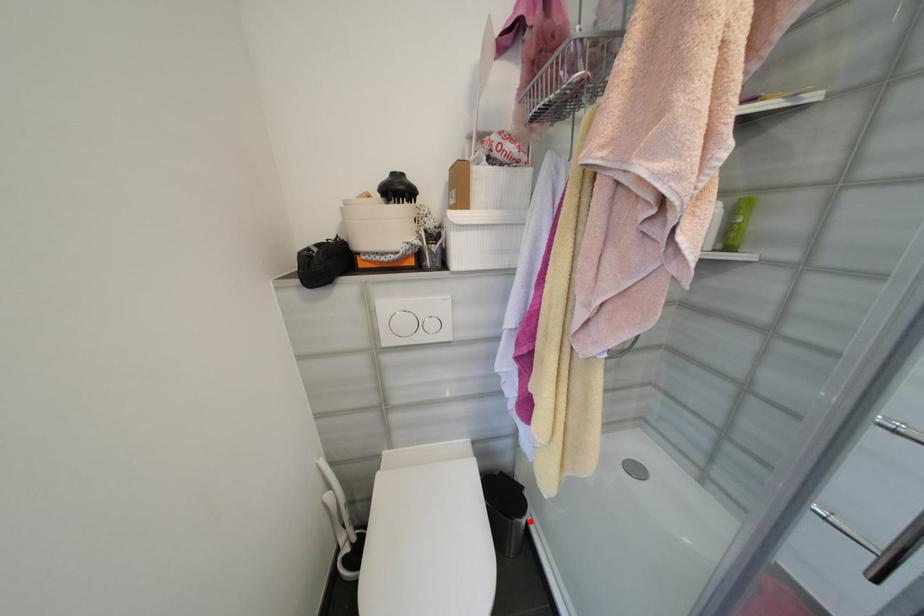
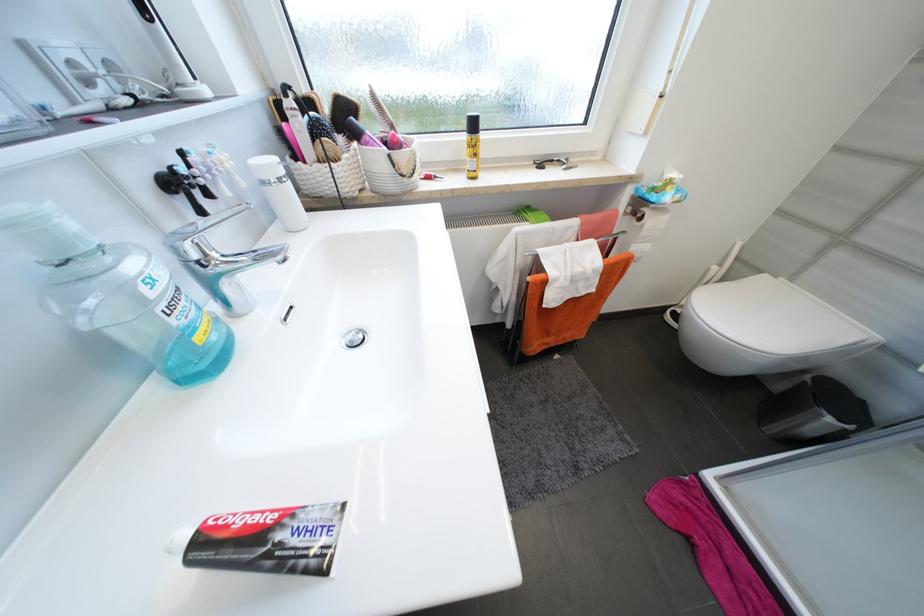
The point at the highlighted location is marked in the first image. Where is the corresponding point in the second image?

(834, 421)